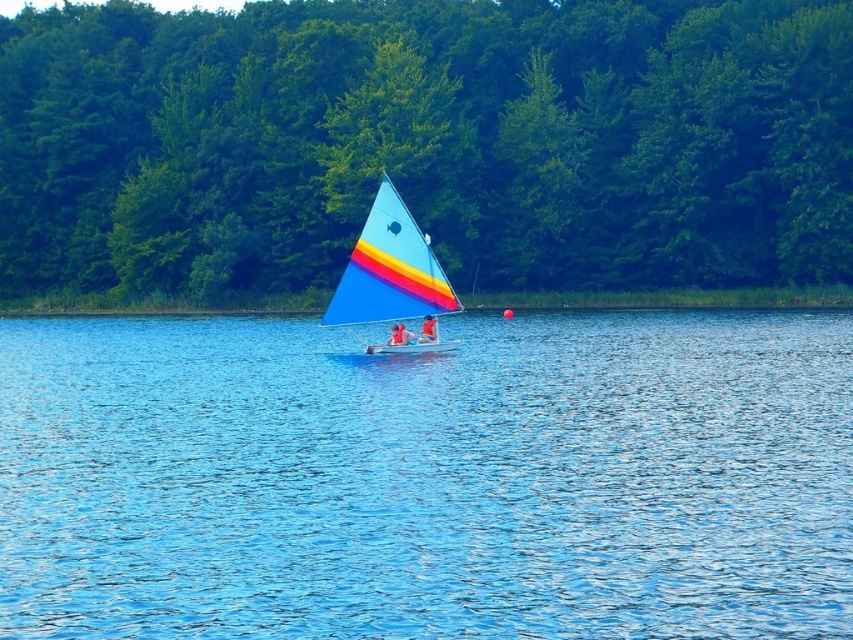
Who is positioned more to the right, green leafy trees at center or matte blue sailboat at center?

matte blue sailboat at center is more to the right.

Does green leafy trees at center have a larger size compared to matte blue sailboat at center?

Yes.

Does point (432, 205) come closer to viewer compared to point (367, 218)?

No, it is behind (367, 218).

Find the location of `green leafy trees at center`. green leafy trees at center is located at coordinates (427, 141).

Image resolution: width=853 pixels, height=640 pixels. What do you see at coordinates (427, 477) in the screenshot?
I see `blue water at center` at bounding box center [427, 477].

Can you confirm if blue water at center is bigger than green leafy trees at center?

Actually, blue water at center might be smaller than green leafy trees at center.

Is point (817, 438) farther from camera compared to point (229, 48)?

No, (817, 438) is in front of (229, 48).

The image size is (853, 640). In order to click on blue water at center in this screenshot , I will do `click(427, 477)`.

Consider the image. Does blue water at center have a lesser width compared to matte blue sailboat at center?

In fact, blue water at center might be wider than matte blue sailboat at center.

Measure the distance from blue water at center to matte blue sailboat at center.

They are 6.97 meters apart.

Describe the element at coordinates (427, 477) in the screenshot. The width and height of the screenshot is (853, 640). I see `blue water at center` at that location.

This screenshot has width=853, height=640. Find the location of `blue water at center`. blue water at center is located at coordinates [x=427, y=477].